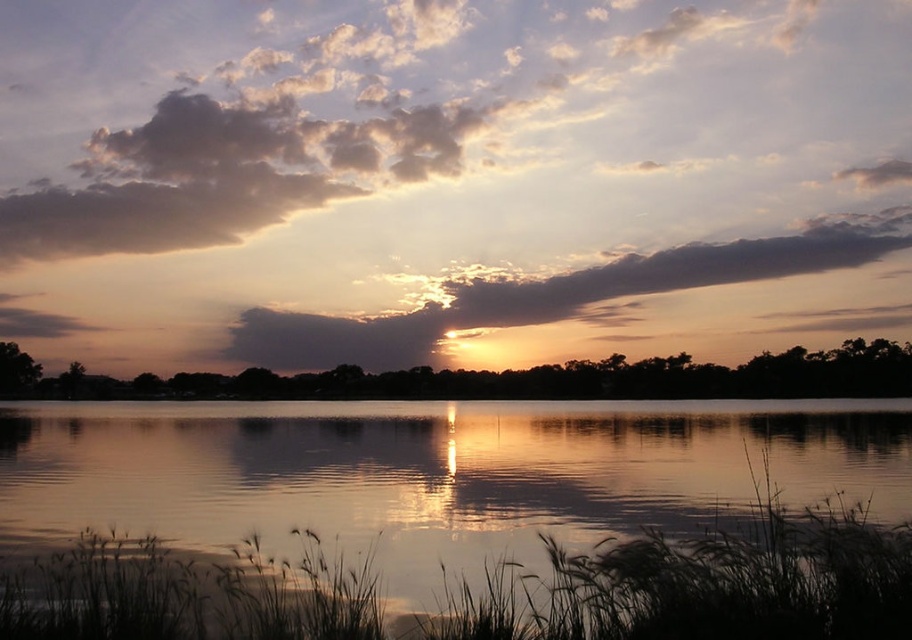
Question: In this image, where is cloudy sky at upper center located relative to smokey gray cloud at upper center?

Choices:
 (A) right
 (B) left

Answer: (B)

Question: Is the position of silvery reflective water at center more distant than that of smokey gray cloud at upper center?

Choices:
 (A) yes
 (B) no

Answer: (B)

Question: Which object appears closest to the camera in this image?

Choices:
 (A) cloudy sky at upper center
 (B) smokey gray cloud at upper center

Answer: (B)

Question: Does cloudy sky at upper center have a lesser width compared to smokey gray cloud at upper center?

Choices:
 (A) yes
 (B) no

Answer: (B)

Question: Among these points, which one is nearest to the camera?

Choices:
 (A) (364, 484)
 (B) (634, 45)

Answer: (A)

Question: Among these points, which one is nearest to the camera?

Choices:
 (A) (550, 317)
 (B) (774, 602)
 (C) (592, 285)

Answer: (B)